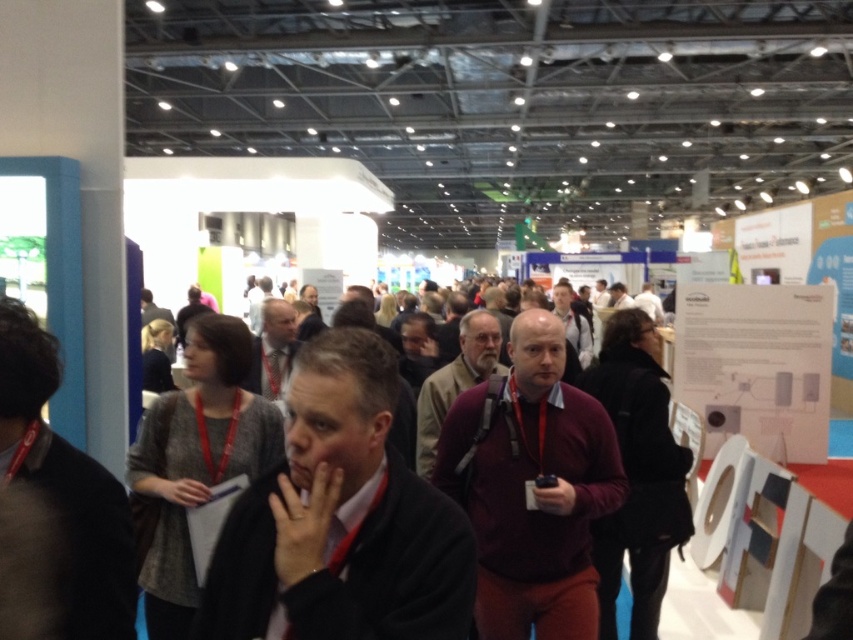
Question: Which object is the farthest from the black matte jacket at center?

Choices:
 (A) black fabric jacket at left
 (B) matte gray suit at center

Answer: (B)

Question: Can you confirm if black matte jacket at center is positioned to the left of matte gray suit at center?

Choices:
 (A) yes
 (B) no

Answer: (B)

Question: Which object is the farthest from the dark brown leather jacket at center?

Choices:
 (A) matte gray suit at center
 (B) black fabric jacket at left
 (C) black matte jacket at center
 (D) matte black jacket at center

Answer: (B)

Question: Among these objects, which one is nearest to the camera?

Choices:
 (A) gray fabric jacket at center
 (B) dark brown leather jacket at center
 (C) maroon sweater at center
 (D) black fabric jacket at left

Answer: (D)

Question: Is black fabric jacket at left to the left of matte black jacket at center from the viewer's perspective?

Choices:
 (A) yes
 (B) no

Answer: (A)

Question: Can you confirm if matte black jacket at center is positioned below dark brown leather jacket at center?

Choices:
 (A) yes
 (B) no

Answer: (A)